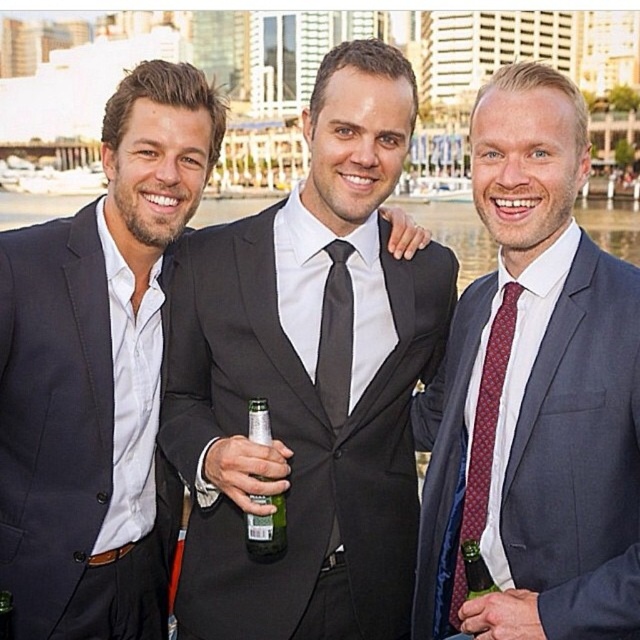
Which is more to the left, matte black suit at center or dark blue wool suit at left?

From the viewer's perspective, dark blue wool suit at left appears more on the left side.

Can you confirm if matte black suit at center is wider than dark blue wool suit at left?

Correct, the width of matte black suit at center exceeds that of dark blue wool suit at left.

Does point (92, 362) come closer to viewer compared to point (92, 486)?

That is False.

Identify the location of matte black suit at center. The width and height of the screenshot is (640, 640). (97, 371).

This screenshot has height=640, width=640. I want to click on matte black suit at center, so click(x=97, y=371).

The height and width of the screenshot is (640, 640). Describe the element at coordinates (97, 371) in the screenshot. I see `matte black suit at center` at that location.

The width and height of the screenshot is (640, 640). Find the location of `matte black suit at center`. matte black suit at center is located at coordinates click(97, 371).

Is black satin suit at center above matte black suit at center?

Incorrect, black satin suit at center is not positioned above matte black suit at center.

What are the coordinates of `black satin suit at center` in the screenshot? It's located at (300, 417).